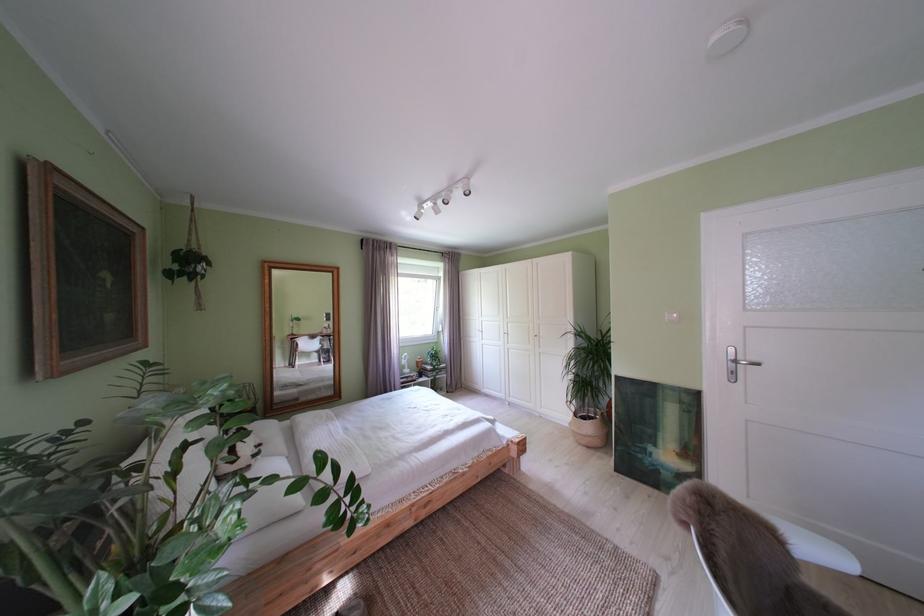
Image resolution: width=924 pixels, height=616 pixels. I want to click on white pillow, so click(325, 445).